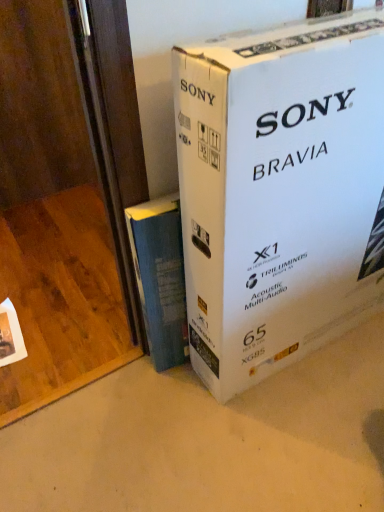
Identify the location of blue fabric book at lower left. The image size is (384, 512). (160, 278).

The height and width of the screenshot is (512, 384). What do you see at coordinates (160, 278) in the screenshot?
I see `blue fabric book at lower left` at bounding box center [160, 278].

What is the approximate height of white cardboard box at center?

white cardboard box at center is 97.43 centimeters tall.

Locate an element on the screen. This screenshot has height=512, width=384. white cardboard box at center is located at coordinates (280, 192).

The image size is (384, 512). Describe the element at coordinates (280, 192) in the screenshot. I see `white cardboard box at center` at that location.

The width and height of the screenshot is (384, 512). In order to click on blue fabric book at lower left in this screenshot , I will do `click(160, 278)`.

Is blue fabric book at lower left at the left side of white cardboard box at center?

Correct, you'll find blue fabric book at lower left to the left of white cardboard box at center.

Considering the relative positions of blue fabric book at lower left and white cardboard box at center in the image provided, is blue fabric book at lower left in front of white cardboard box at center?

That is False.

Is point (154, 216) closer or farther from the camera than point (339, 292)?

Point (154, 216) is positioned closer to the camera compared to point (339, 292).

From the image's perspective, which is above, blue fabric book at lower left or white cardboard box at center?

white cardboard box at center is shown above in the image.

From a real-world perspective, who is located lower, blue fabric book at lower left or white cardboard box at center?

blue fabric book at lower left.

Can you confirm if blue fabric book at lower left is wider than white cardboard box at center?

No, blue fabric book at lower left is not wider than white cardboard box at center.

Considering the relative sizes of blue fabric book at lower left and white cardboard box at center in the image provided, is blue fabric book at lower left taller than white cardboard box at center?

No.

Can you confirm if blue fabric book at lower left is smaller than white cardboard box at center?

Indeed, blue fabric book at lower left has a smaller size compared to white cardboard box at center.

Is blue fabric book at lower left located outside white cardboard box at center?

Yes, blue fabric book at lower left is located beyond the bounds of white cardboard box at center.

Are blue fabric book at lower left and white cardboard box at center located far from each other?

Actually, blue fabric book at lower left and white cardboard box at center are a little close together.

Is blue fabric book at lower left looking in the opposite direction of white cardboard box at center?

No, blue fabric book at lower left is not facing the opposite direction of white cardboard box at center.

How different are the orientations of blue fabric book at lower left and white cardboard box at center in degrees?

4.82 degrees.

Image resolution: width=384 pixels, height=512 pixels. Identify the location of box that appears on the right of blue fabric book at lower left. (280, 192).

Is white cardboard box at center to the right of blue fabric book at lower left from the viewer's perspective?

Yes, white cardboard box at center is to the right of blue fabric book at lower left.

Is white cardboard box at center closer to camera compared to blue fabric book at lower left?

Yes.

Considering the positions of points (340, 93) and (180, 332), is point (340, 93) farther from camera compared to point (180, 332)?

No, (340, 93) is closer to viewer.

From the image's perspective, who appears lower, white cardboard box at center or blue fabric book at lower left?

blue fabric book at lower left, from the image's perspective.

From the picture: From a real-world perspective, which is physically below, white cardboard box at center or blue fabric book at lower left?

From a 3D spatial view, blue fabric book at lower left is below.

Which of these two, white cardboard box at center or blue fabric book at lower left, is wider?

Wider between the two is white cardboard box at center.

From their relative heights in the image, would you say white cardboard box at center is taller or shorter than blue fabric book at lower left?

Clearly, white cardboard box at center is taller compared to blue fabric book at lower left.

In terms of size, does white cardboard box at center appear bigger or smaller than blue fabric book at lower left?

In the image, white cardboard box at center appears to be larger than blue fabric book at lower left.

Is white cardboard box at center spatially inside blue fabric book at lower left, or outside of it?

Result: The correct answer is: outside.

Is white cardboard box at center in contact with blue fabric book at lower left?

white cardboard box at center is not next to blue fabric book at lower left, and they're not touching.

Does white cardboard box at center turn towards blue fabric book at lower left?

No, white cardboard box at center is not oriented towards blue fabric book at lower left.

How many degrees apart are the facing directions of white cardboard box at center and blue fabric book at lower left?

They differ by 4.82 degrees in their facing directions.

How much distance is there between white cardboard box at center and blue fabric book at lower left?

The distance of white cardboard box at center from blue fabric book at lower left is 25.40 centimeters.

Locate an element on the screen. book below the white cardboard box at center (from the image's perspective) is located at coordinates (160, 278).

At what (x,y) coordinates should I click in order to perform the action: click on box that is in front of the blue fabric book at lower left. Please return your answer as a coordinate pair (x, y). The height and width of the screenshot is (512, 384). Looking at the image, I should click on (280, 192).

Where is `book behind the white cardboard box at center`? book behind the white cardboard box at center is located at coordinates (160, 278).